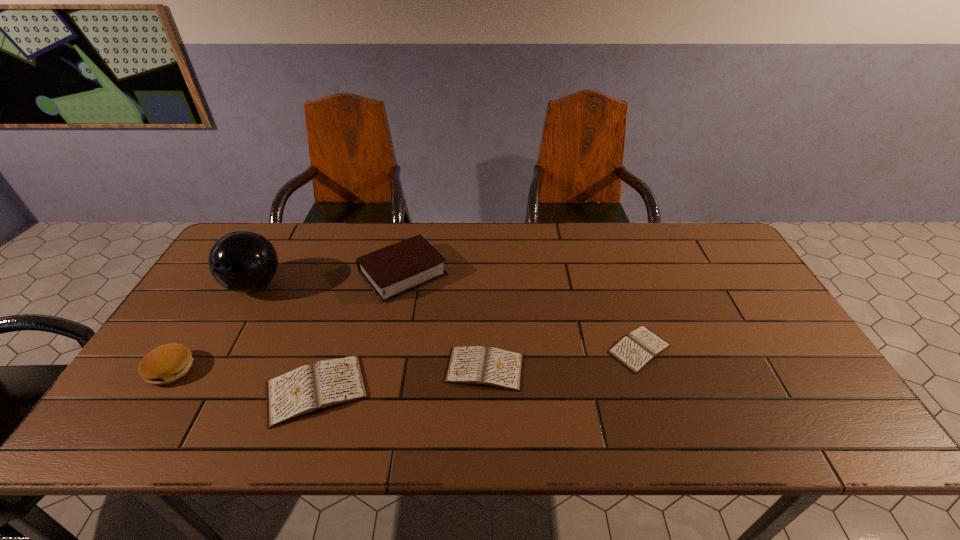
This screenshot has width=960, height=540. I want to click on vacant place for an extra diary on the right, so click(781, 331).